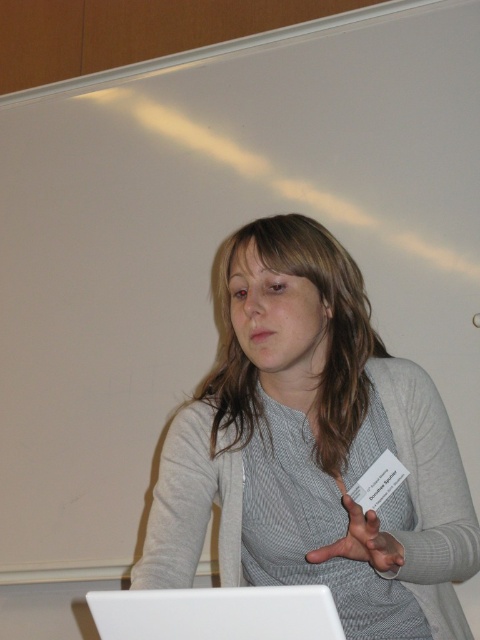
Does white plastic laptop at lower center have a lesser height compared to matte gray hand at center?

Correct, white plastic laptop at lower center is not as tall as matte gray hand at center.

Is white plastic laptop at lower center positioned behind matte gray hand at center?

No, white plastic laptop at lower center is in front of matte gray hand at center.

Locate an element on the screen. The height and width of the screenshot is (640, 480). white plastic laptop at lower center is located at coordinates (216, 612).

Does point (346, 372) come behind point (394, 554)?

Yes, it is.

Is gray matte sweater at center below matte gray hand at center?

Incorrect, gray matte sweater at center is not positioned below matte gray hand at center.

This screenshot has height=640, width=480. Identify the location of gray matte sweater at center. (312, 449).

Is gray matte sweater at center behind white plastic laptop at lower center?

Yes.

Does gray matte sweater at center appear over white plastic laptop at lower center?

Yes.

Who is more distant from viewer, (445, 442) or (271, 602)?

Point (445, 442)

This screenshot has height=640, width=480. In order to click on gray matte sweater at center in this screenshot , I will do `click(312, 449)`.